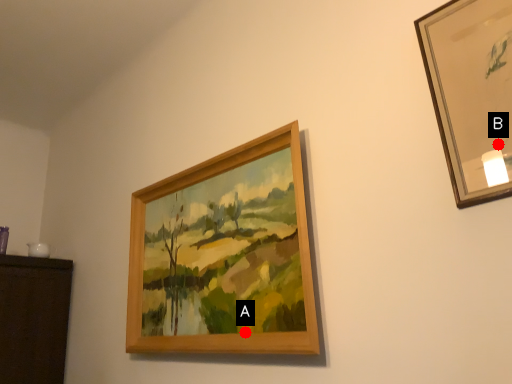
Question: Two points are circled on the image, labeled by A and B beside each circle. Which point is closer to the camera?

Choices:
 (A) A is closer
 (B) B is closer

Answer: (B)